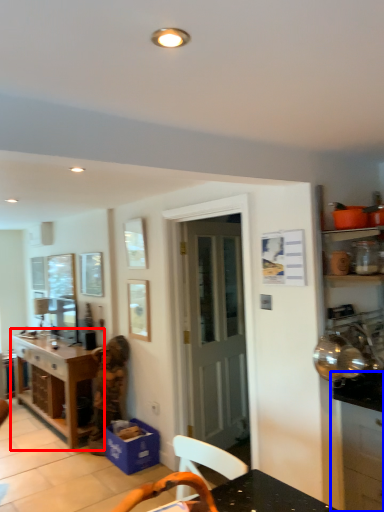
Question: Which of the following is the farthest to the observer, table (highlighted by a red box) or cabinetry (highlighted by a blue box)?

Choices:
 (A) table
 (B) cabinetry

Answer: (A)